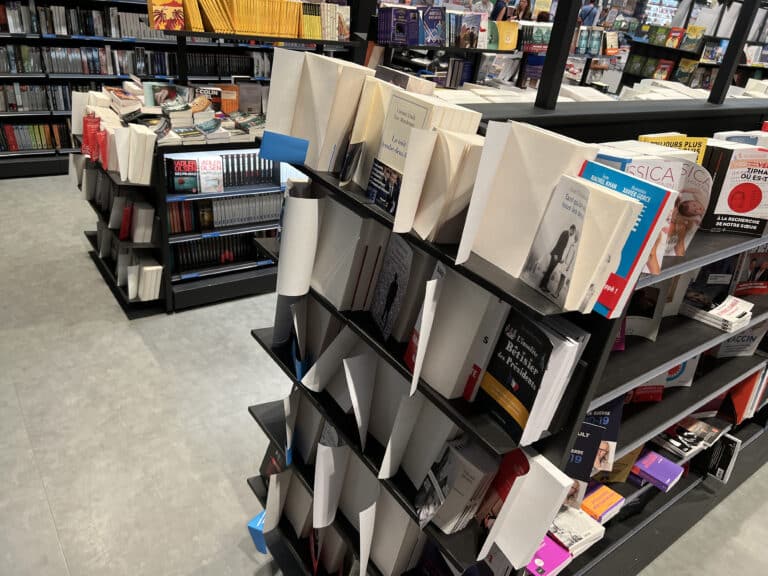
I want to click on white papers, so click(x=707, y=15).